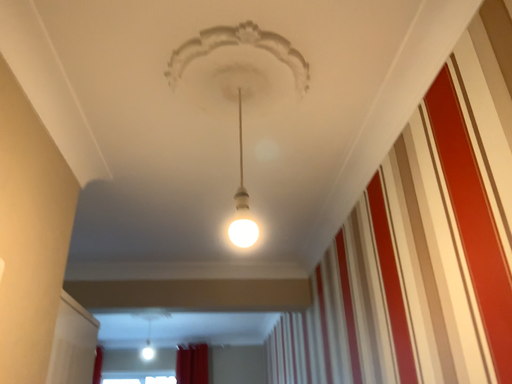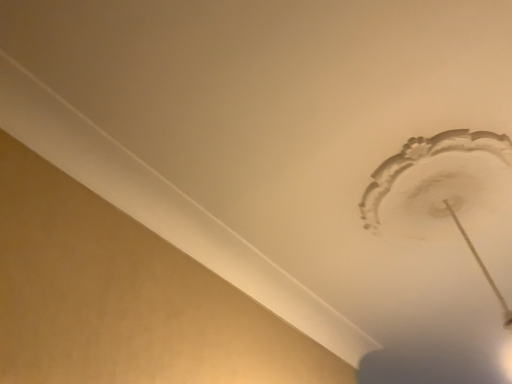
Question: Which way did the camera rotate in the video?

Choices:
 (A) rotated left
 (B) rotated right

Answer: (A)